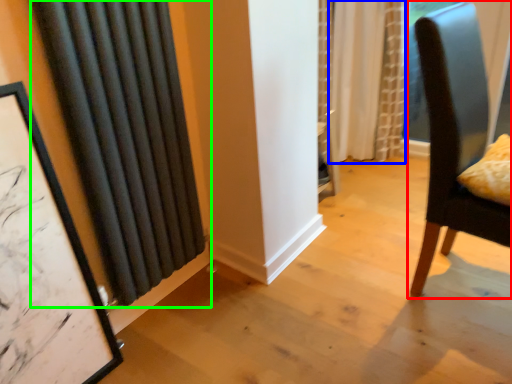
Question: Estimate the real-world distances between objects in this image. Which object is closer to chair (highlighted by a red box), curtain (highlighted by a blue box) or curtain (highlighted by a green box)?

Choices:
 (A) curtain
 (B) curtain

Answer: (B)